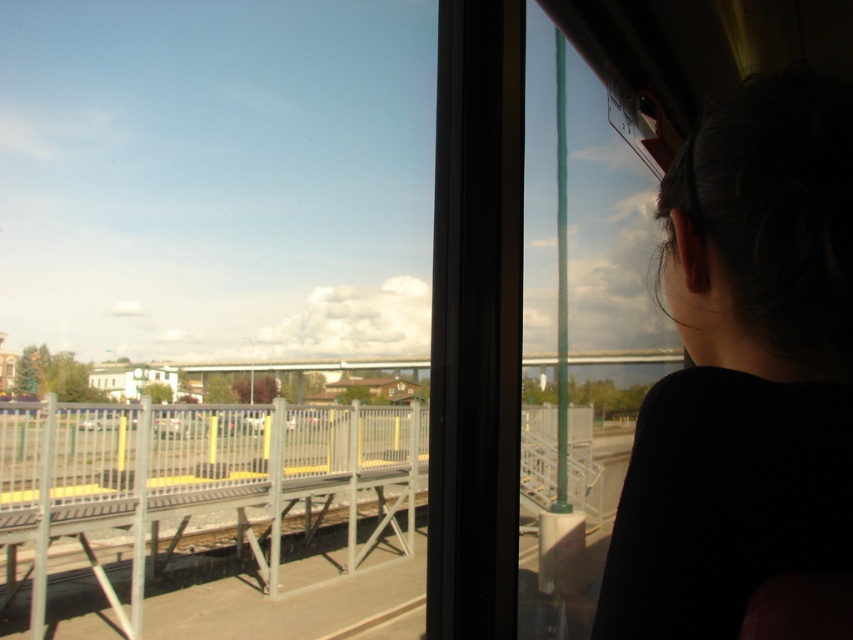
Who is positioned more to the right, dark hair at upper right or metal/textured rail at center?

From the viewer's perspective, dark hair at upper right appears more on the right side.

Can you confirm if dark hair at upper right is wider than metal/textured rail at center?

Incorrect, dark hair at upper right's width does not surpass metal/textured rail at center's.

Describe the element at coordinates (744, 369) in the screenshot. The height and width of the screenshot is (640, 853). I see `dark hair at upper right` at that location.

Locate an element on the screen. The width and height of the screenshot is (853, 640). dark hair at upper right is located at coordinates (744, 369).